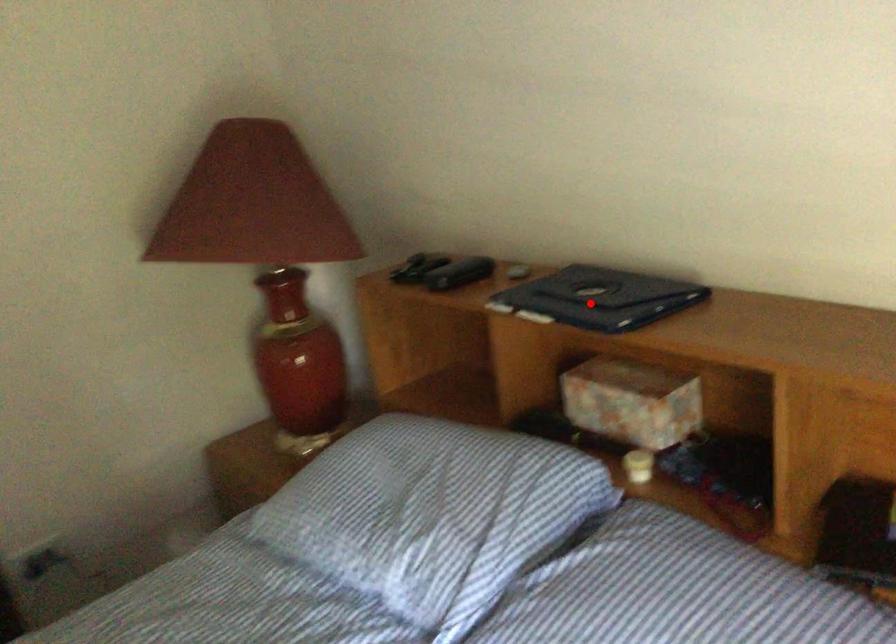
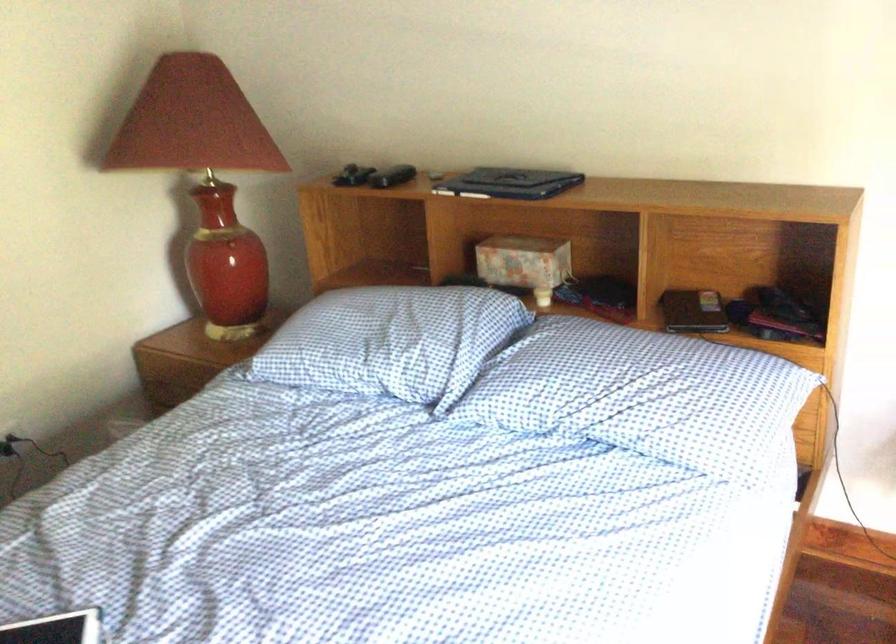
Where in the second image is the point corresponding to the highlighted location from the first image?

(510, 183)